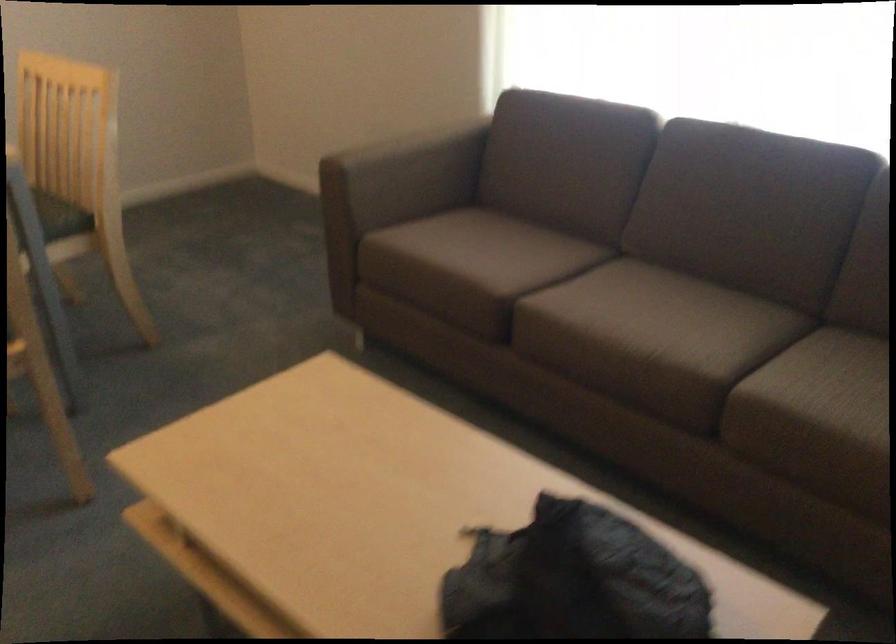
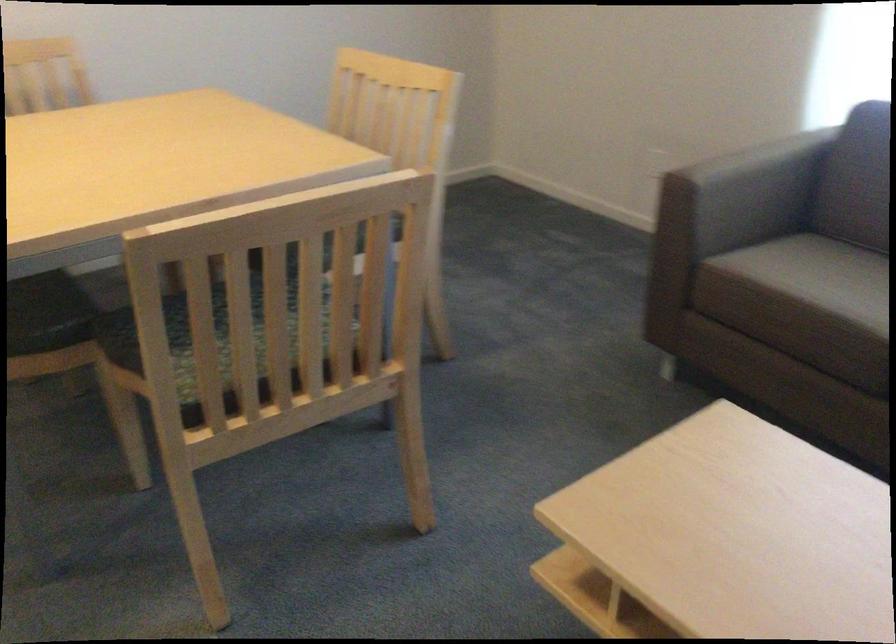
Question: I am providing you with two images of the same scene from different viewpoints. Which of the following objects are not visible in image2?

Choices:
 (A) blue tardis box
 (B) brown sofa armrest
 (C) dark sofa sitting surface
 (D) chair sitting surface

Answer: (D)